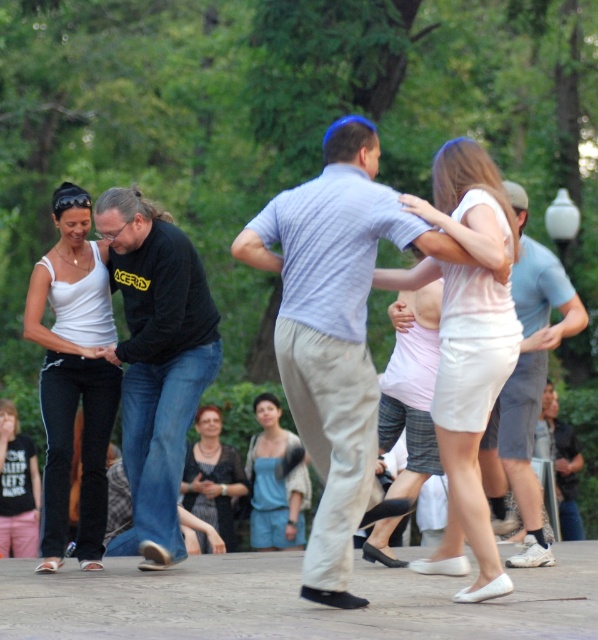
You are a photographer trying to capture the couple dancing in the center of the image. You want to ensure that both the light blue striped shirt at center and the white matte skirt at center are clearly visible in your photo. Based on their positions, which one should you focus on first to ensure both are in focus?

The light blue striped shirt at center is in front of the white matte skirt at center, so focusing on the light blue striped shirt at center first will help ensure both are in focus since it is closer to the camera.

Looking at this image, where is the white matte skirt at center located in the image?

The white matte skirt at center is located at point (466, 346) in the image.